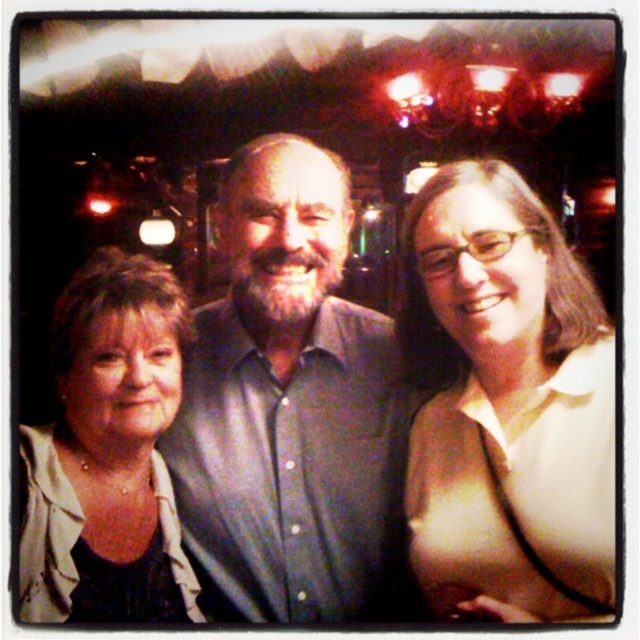
Question: Which of the following is the closest to the observer?

Choices:
 (A) (83, 349)
 (B) (84, 499)
 (C) (252, 209)
 (D) (608, 413)

Answer: (D)

Question: In this image, where is green matte shirt at center located relative to matte green shirt at center?

Choices:
 (A) left
 (B) right

Answer: (A)

Question: Is matte green shirt at center positioned in front of matte beige jacket at lower left?

Choices:
 (A) no
 (B) yes

Answer: (B)

Question: Which point is closer to the camera?

Choices:
 (A) (52, 316)
 (B) (454, 252)
 (C) (300, 192)

Answer: (B)

Question: From the image, what is the correct spatial relationship of green matte shirt at center in relation to matte white shirt at center?

Choices:
 (A) right
 (B) left

Answer: (B)

Question: Which object is closer to the camera taking this photo?

Choices:
 (A) matte white shirt at center
 (B) matte beige jacket at lower left
 (C) green matte shirt at center
 (D) matte green shirt at center

Answer: (A)